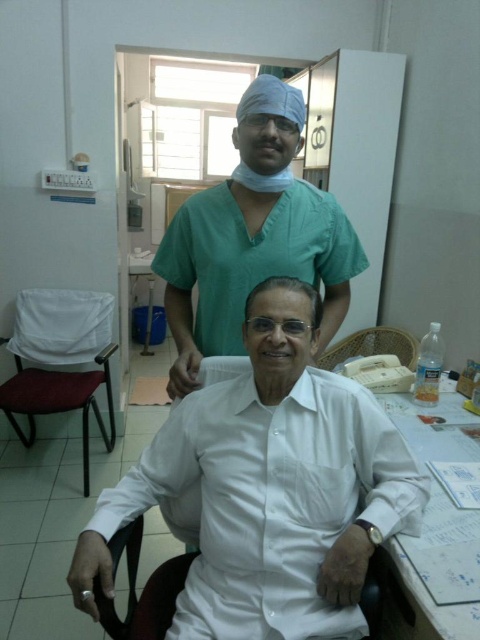
Question: Which of these objects is positioned farthest from the woven fabric chair at center?

Choices:
 (A) white smooth shirt at center
 (B) green scrubs at upper center

Answer: (A)

Question: Estimate the real-world distances between objects in this image. Which object is farther from the white fabric chair at left?

Choices:
 (A) woven fabric chair at center
 (B) green scrubs at upper center

Answer: (B)

Question: Is green scrubs at upper center in front of white fabric chair at left?

Choices:
 (A) no
 (B) yes

Answer: (B)

Question: Does white smooth shirt at center have a greater width compared to green scrubs at upper center?

Choices:
 (A) yes
 (B) no

Answer: (A)

Question: Does white smooth shirt at center have a greater width compared to white fabric chair at left?

Choices:
 (A) yes
 (B) no

Answer: (A)

Question: Among these objects, which one is farthest from the camera?

Choices:
 (A) white smooth shirt at center
 (B) woven fabric chair at center
 (C) white fabric chair at left
 (D) green scrubs at upper center

Answer: (C)